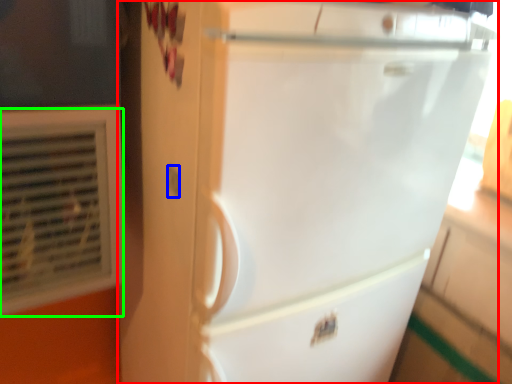
Question: Based on their relative distances, which object is nearer to refrigerator (highlighted by a red box)? Choose from electric outlet (highlighted by a blue box) and air conditioning (highlighted by a green box).

Choices:
 (A) electric outlet
 (B) air conditioning

Answer: (B)